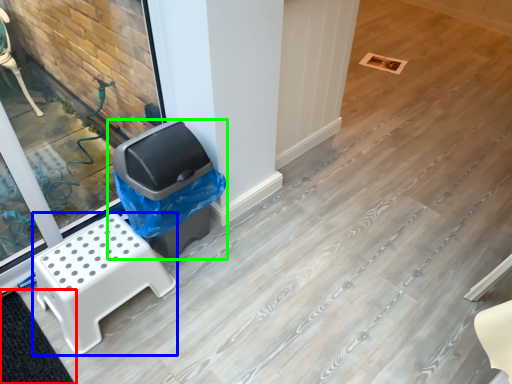
Question: Based on their relative distances, which object is farther from mat (highlighted by a red box)? Choose from furniture (highlighted by a blue box) and waste container (highlighted by a green box).

Choices:
 (A) furniture
 (B) waste container

Answer: (B)